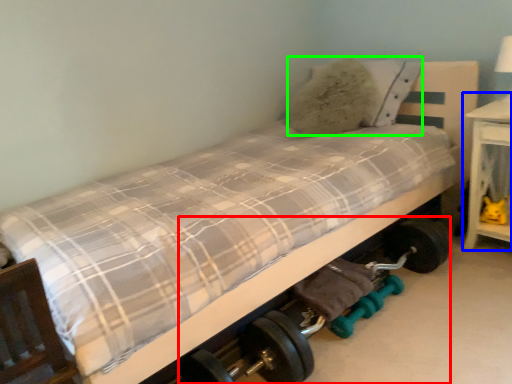
Question: Considering the real-world distances, which object is closest to baby carriage (highlighted by a red box)? table (highlighted by a blue box) or pillow (highlighted by a green box).

Choices:
 (A) table
 (B) pillow

Answer: (A)